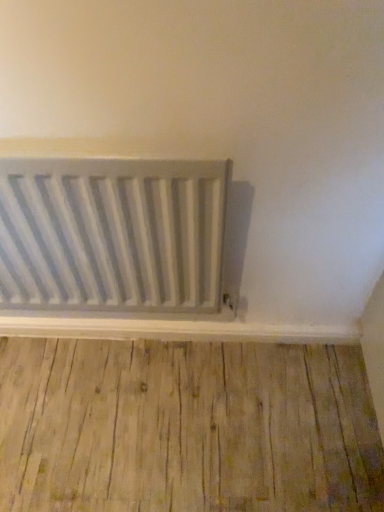
Question: From the image's perspective, is light brown wood flooring at lower center located above or below white matte radiator at center?

Choices:
 (A) above
 (B) below

Answer: (B)

Question: Is light brown wood flooring at lower center inside or outside of white matte radiator at center?

Choices:
 (A) outside
 (B) inside

Answer: (A)

Question: Relative to white matte radiator at center, is light brown wood flooring at lower center in front or behind?

Choices:
 (A) behind
 (B) front

Answer: (A)

Question: Would you say white matte radiator at center is to the left or to the right of light brown wood flooring at lower center in the picture?

Choices:
 (A) left
 (B) right

Answer: (A)

Question: From a real-world perspective, is white matte radiator at center positioned above or below light brown wood flooring at lower center?

Choices:
 (A) above
 (B) below

Answer: (A)

Question: Considering the positions of white matte radiator at center and light brown wood flooring at lower center in the image, is white matte radiator at center taller or shorter than light brown wood flooring at lower center?

Choices:
 (A) short
 (B) tall

Answer: (B)

Question: Is white matte radiator at center inside or outside of light brown wood flooring at lower center?

Choices:
 (A) outside
 (B) inside

Answer: (A)